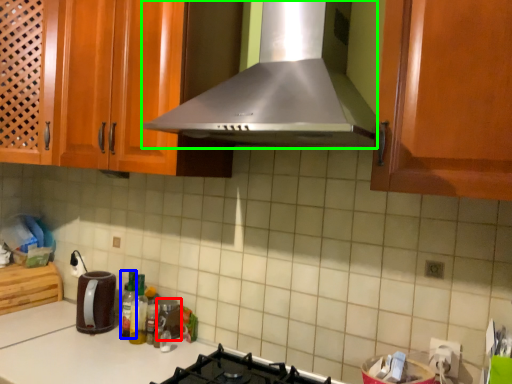
Question: Which object is the closest to the appliance (highlighted by a red box)? Choose among these: bottle (highlighted by a blue box) or home appliance (highlighted by a green box).

Choices:
 (A) bottle
 (B) home appliance

Answer: (A)